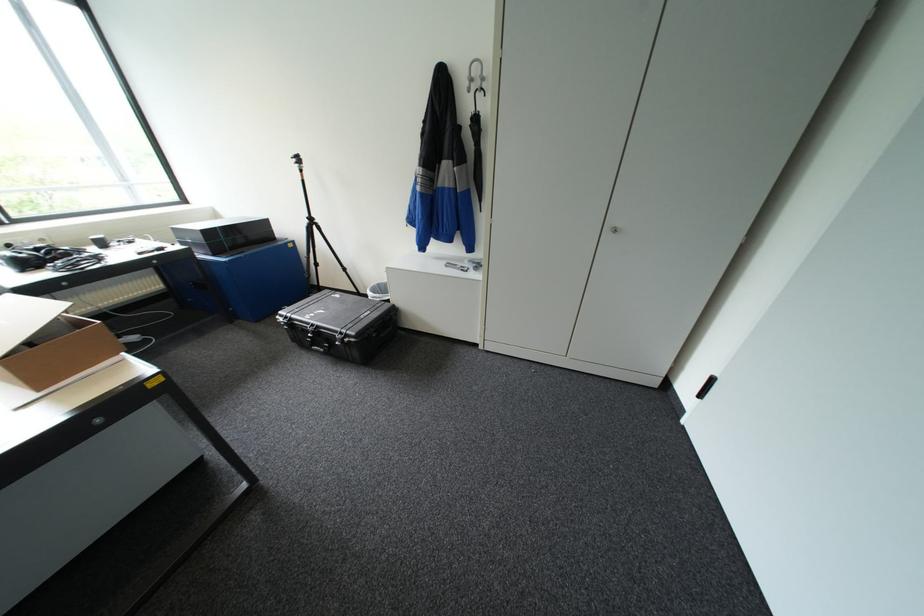
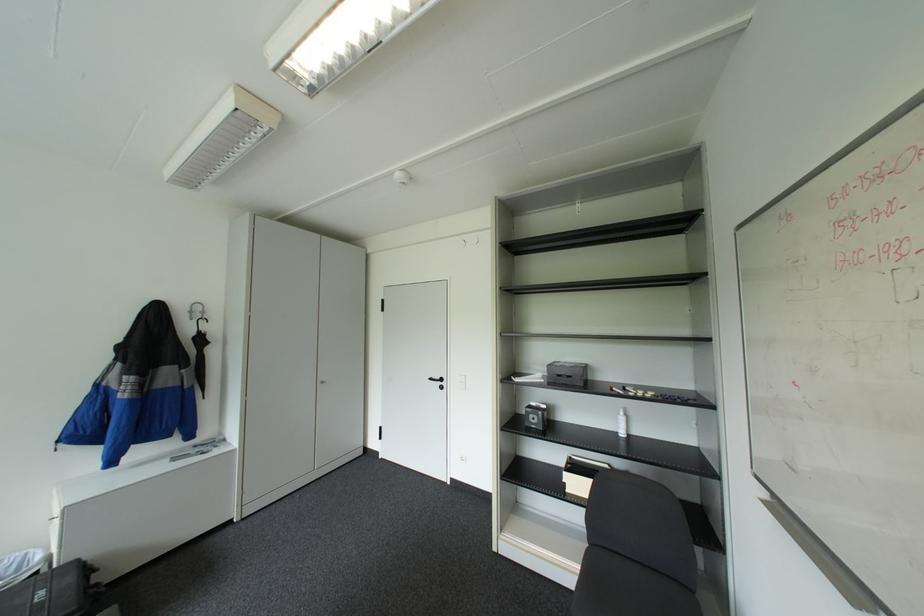
The point at (x=477, y=90) is marked in the first image. Where is the corresponding point in the second image?

(200, 318)